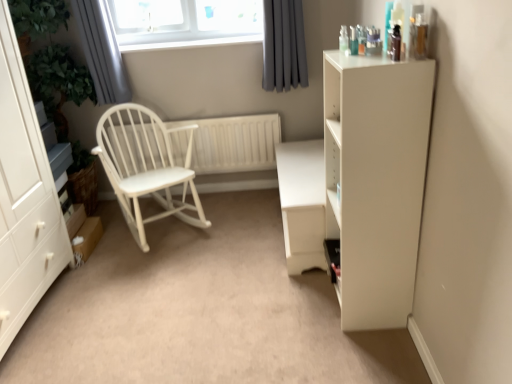
Question: Does white wood radiator at center contain white matte cabinet at left?

Choices:
 (A) yes
 (B) no

Answer: (B)

Question: Can you confirm if white wood radiator at center is wider than white matte cabinet at left?

Choices:
 (A) no
 (B) yes

Answer: (A)

Question: Is white wood radiator at center at the left side of white matte cabinet at left?

Choices:
 (A) no
 (B) yes

Answer: (A)

Question: Is white wood radiator at center oriented towards white matte cabinet at left?

Choices:
 (A) yes
 (B) no

Answer: (A)

Question: Is white wood radiator at center not close to white matte cabinet at left?

Choices:
 (A) no
 (B) yes

Answer: (B)

Question: Looking at the image, does white matte cabinet at right seem bigger or smaller compared to gray fabric curtain at upper left, acting as the 2th curtain starting from the right?

Choices:
 (A) small
 (B) big

Answer: (B)

Question: Considering the positions of point (362, 61) and point (109, 99), is point (362, 61) closer or farther from the camera than point (109, 99)?

Choices:
 (A) farther
 (B) closer

Answer: (B)

Question: Is white matte cabinet at right spatially inside gray fabric curtain at upper left, acting as the 2th curtain starting from the right, or outside of it?

Choices:
 (A) inside
 (B) outside

Answer: (B)

Question: From the image's perspective, is white matte cabinet at right located above or below gray fabric curtain at upper left, the 1th curtain viewed from the left?

Choices:
 (A) below
 (B) above

Answer: (A)

Question: From a real-world perspective, is white wood rocking chair at left positioned above or below white matte table at center?

Choices:
 (A) above
 (B) below

Answer: (A)

Question: In the image, is white wood rocking chair at left positioned in front of or behind white matte table at center?

Choices:
 (A) front
 (B) behind

Answer: (B)

Question: Is white wood rocking chair at left spatially inside white matte table at center, or outside of it?

Choices:
 (A) outside
 (B) inside

Answer: (A)

Question: Considering the positions of white wood rocking chair at left and white matte table at center in the image, is white wood rocking chair at left bigger or smaller than white matte table at center?

Choices:
 (A) big
 (B) small

Answer: (A)

Question: From a real-world perspective, relative to white wood radiator at center, is white matte cabinet at right vertically above or below?

Choices:
 (A) above
 (B) below

Answer: (A)

Question: Does point (326, 211) appear closer or farther from the camera than point (223, 119)?

Choices:
 (A) closer
 (B) farther

Answer: (A)